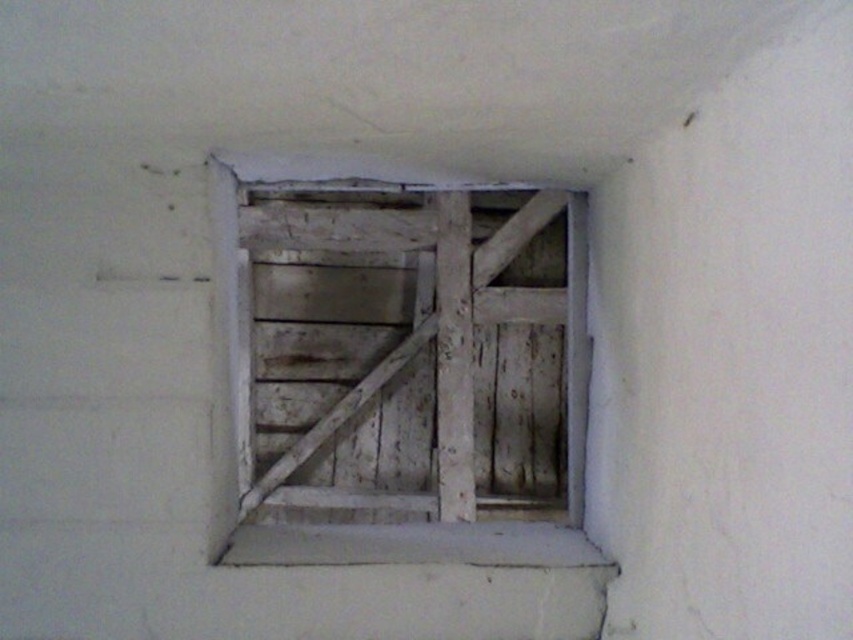
Question: Is weathered wood door at center positioned behind white wood window sill at center?

Choices:
 (A) no
 (B) yes

Answer: (B)

Question: Which object is the farthest from the white wood window sill at center?

Choices:
 (A) weathered wood door at center
 (B) weathered wood window frame at center

Answer: (A)

Question: Which object appears farthest from the camera in this image?

Choices:
 (A) weathered wood door at center
 (B) weathered wood window frame at center
 (C) white wood window sill at center

Answer: (A)

Question: Can you confirm if weathered wood window frame at center is positioned to the left of white wood window sill at center?

Choices:
 (A) no
 (B) yes

Answer: (B)

Question: Which point is closer to the camera?

Choices:
 (A) weathered wood window frame at center
 (B) weathered wood door at center

Answer: (A)

Question: In this image, where is weathered wood window frame at center located relative to white wood window sill at center?

Choices:
 (A) left
 (B) right

Answer: (A)